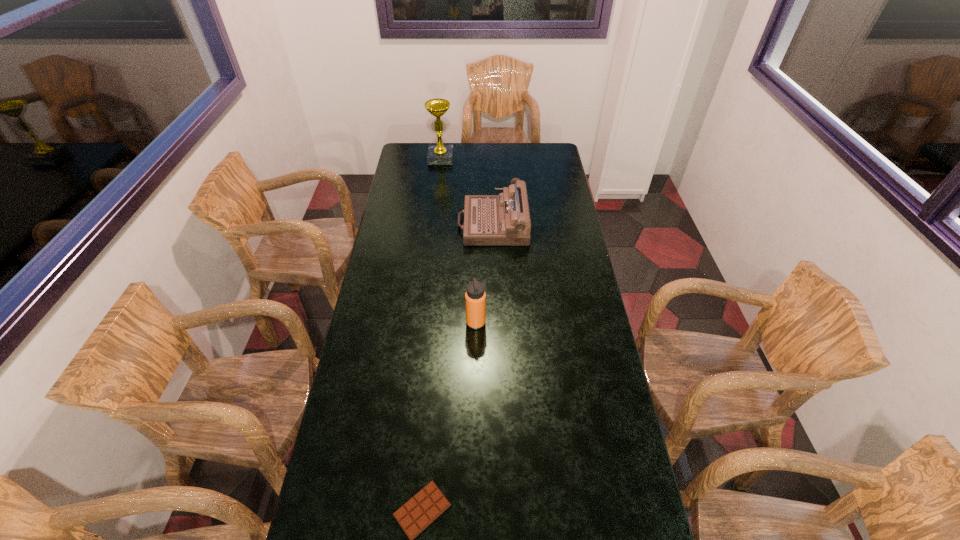
The height and width of the screenshot is (540, 960). Identify the location of award. (439, 154).

The image size is (960, 540). I want to click on the tallest object, so click(439, 154).

You are a GUI agent. You are given a task and a screenshot of the screen. Output one action in this format:
    pyautogui.click(x=<x>, y=<y>)
    Task: Click on the third farthest object
    This screenshot has width=960, height=540.
    Given the screenshot: What is the action you would take?
    pyautogui.click(x=475, y=297)

Where is `the second tallest object`? the second tallest object is located at coordinates (475, 297).

Find the location of `the second shortest object`. the second shortest object is located at coordinates (504, 219).

Locate an element on the screen. The height and width of the screenshot is (540, 960). the third nearest object is located at coordinates (504, 219).

You are a GUI agent. You are given a task and a screenshot of the screen. Output one action in this format:
    pyautogui.click(x=<x>, y=<y>)
    Task: Click on the vacant space located on the front-facing side of the award
    Image resolution: width=960 pixels, height=540 pixels.
    Given the screenshot: What is the action you would take?
    pyautogui.click(x=439, y=174)

Image resolution: width=960 pixels, height=540 pixels. I want to click on vacant space located 0.050m on the front of the second nearest object, so click(475, 342).

This screenshot has width=960, height=540. Identify the location of blank area located on the keyboard of the second shortest object. (440, 224).

Where is `vacant space located on the keyboard of the second shortest object`? The height and width of the screenshot is (540, 960). vacant space located on the keyboard of the second shortest object is located at coordinates (436, 224).